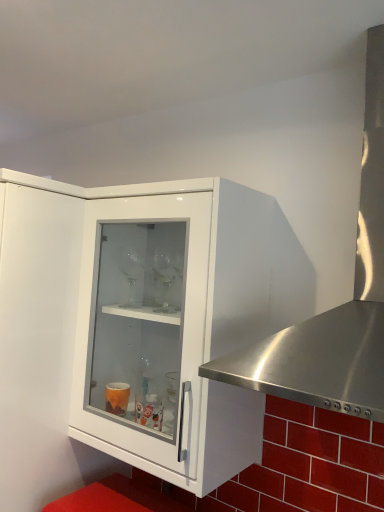
Question: Considering their positions, is stainless steel range hood at right located in front of or behind white glossy cabinet at center?

Choices:
 (A) front
 (B) behind

Answer: (A)

Question: In terms of width, does stainless steel range hood at right look wider or thinner when compared to white glossy cabinet at center?

Choices:
 (A) thin
 (B) wide

Answer: (B)

Question: From the image's perspective, relative to white glossy cabinet at center, is stainless steel range hood at right above or below?

Choices:
 (A) below
 (B) above

Answer: (B)

Question: From their relative heights in the image, would you say white glossy cabinet at center is taller or shorter than stainless steel range hood at right?

Choices:
 (A) short
 (B) tall

Answer: (B)

Question: Does point (175, 434) appear closer or farther from the camera than point (349, 395)?

Choices:
 (A) farther
 (B) closer

Answer: (A)

Question: Based on their positions, is white glossy cabinet at center located to the left or right of stainless steel range hood at right?

Choices:
 (A) left
 (B) right

Answer: (A)

Question: Looking at the image, does white glossy cabinet at center seem bigger or smaller compared to stainless steel range hood at right?

Choices:
 (A) small
 (B) big

Answer: (A)